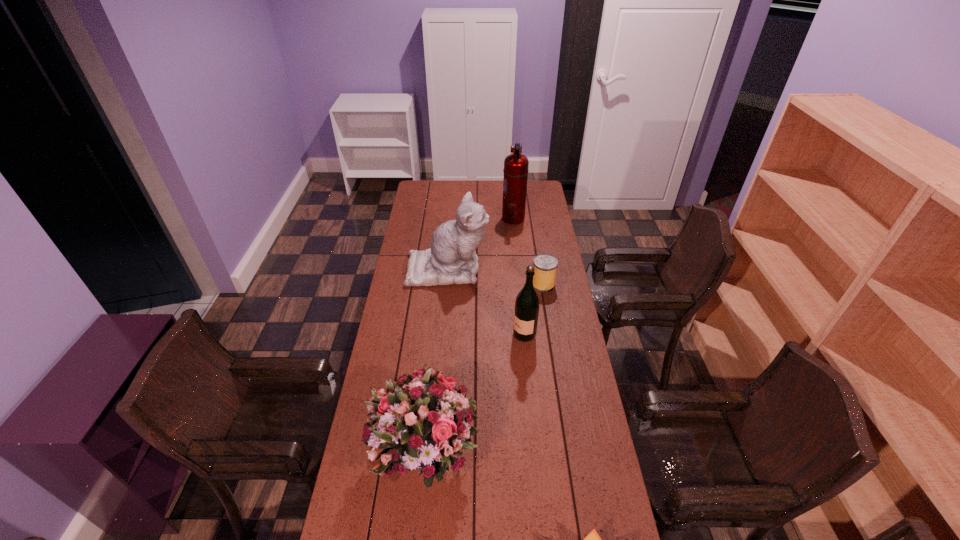
At what (x,y) coordinates should I click in order to perform the action: click on vacant space located 0.200m on the front-facing side of the liquor. Please return your answer as a coordinate pair (x, y). Looking at the image, I should click on (464, 335).

The height and width of the screenshot is (540, 960). Identify the location of free location located 0.130m on the front-facing side of the liquor. (481, 335).

Where is `free location located 0.060m on the back of the bouquet`? The image size is (960, 540). free location located 0.060m on the back of the bouquet is located at coordinates (432, 390).

This screenshot has width=960, height=540. Identify the location of free space located 0.090m on the left of the can. (512, 284).

What are the coordinates of `cat present at the left edge` in the screenshot? It's located at coord(452,259).

Locate an element on the screen. The width and height of the screenshot is (960, 540). bouquet located at the left edge is located at coordinates (423, 418).

Find the location of `fire extinguisher present at the right edge`. fire extinguisher present at the right edge is located at coordinates (516, 165).

Where is `can situated at the right edge`? This screenshot has width=960, height=540. can situated at the right edge is located at coordinates (545, 265).

Where is `vacant region at the far edge`? Image resolution: width=960 pixels, height=540 pixels. vacant region at the far edge is located at coordinates (476, 183).

This screenshot has height=540, width=960. Find the location of `free space at the left edge of the desktop`. free space at the left edge of the desktop is located at coordinates (356, 514).